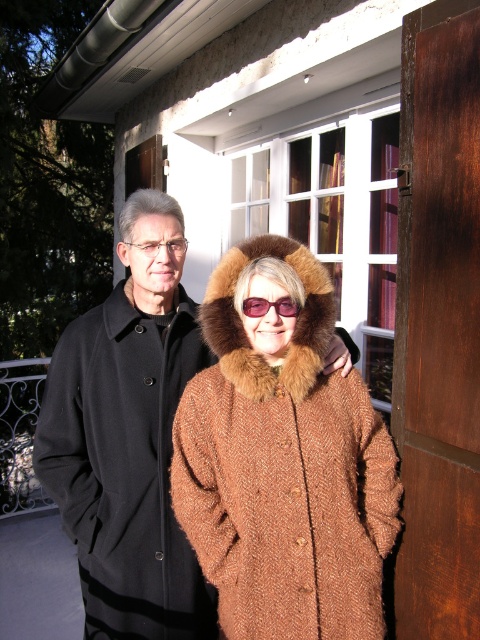
You are a tailor measuring coats for alterations. You have two coats in front of you, the brown woolen coat at center and the black wool coat at left. Which coat requires a longer hem to match the other in height?

The brown woolen coat at center is not as tall as the black wool coat at left, so it requires a longer hem to match the height of the black wool coat at left.

You are a photographer trying to capture a clear shot of both the black wool coat at left and the pink plastic goggles at center. Since you want to ensure both are in focus, you need to know their vertical positions. Which object is positioned lower in the image?

The black wool coat at left is located below the pink plastic goggles at center, so the black wool coat at left is positioned lower in the image.

In the scene shown: You are a delivery person who needs to place a small package between the pink plastic goggles at center and the matte black glasses at upper left. The package is 18 inches long. Will it fit between them without overlapping either object?

The distance between the pink plastic goggles at center and the matte black glasses at upper left is 17.57 inches. Since the package is 18 inches long, it will not fit between them without overlapping either object.